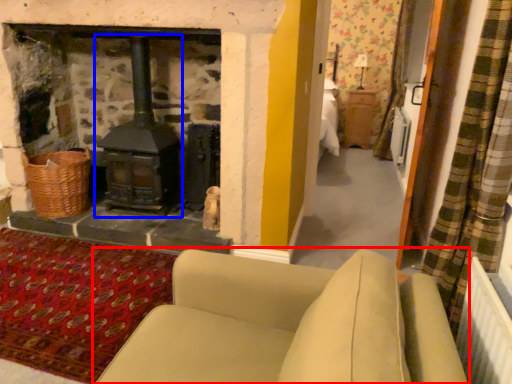
Question: Which of the following is the closest to the observer, studio couch (highlighted by a red box) or wood burning stove (highlighted by a blue box)?

Choices:
 (A) studio couch
 (B) wood burning stove

Answer: (A)